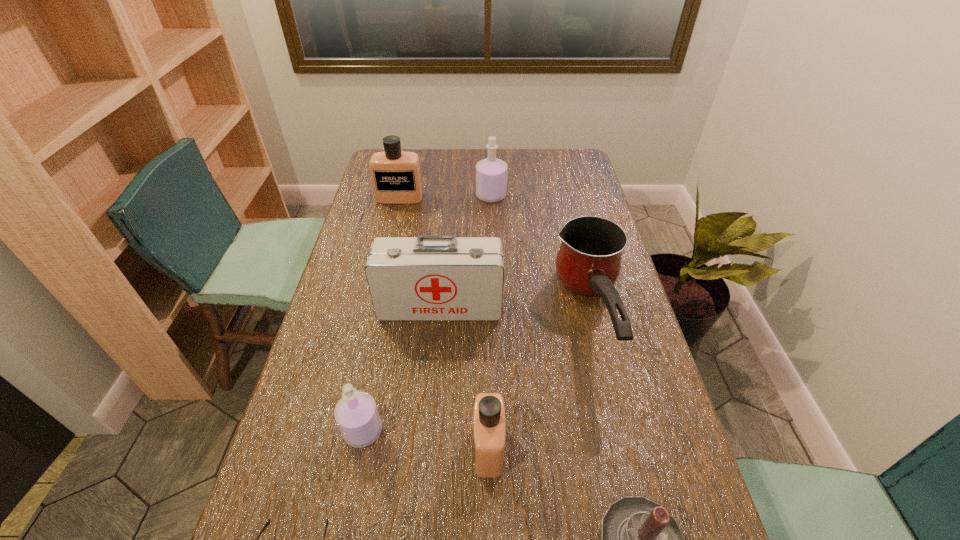
This screenshot has width=960, height=540. I want to click on the farther purple perfume, so click(491, 173).

Find the location of a particular element. The height and width of the screenshot is (540, 960). the bigger purple perfume is located at coordinates (491, 173).

Find the location of a particular element. the left beige perfume is located at coordinates (396, 176).

This screenshot has height=540, width=960. What are the coordinates of `the bigger beige perfume` in the screenshot? It's located at (396, 176).

Find the location of a particular element. red first-aid kit is located at coordinates (427, 278).

I want to click on saucepan, so click(x=588, y=262).

This screenshot has width=960, height=540. What are the coordinates of `the left purple perfume` in the screenshot? It's located at (356, 414).

The image size is (960, 540). Identify the location of the smaller purple perfume. (356, 414).

The image size is (960, 540). I want to click on the right beige perfume, so click(489, 427).

Find the location of a particular element. Image resolution: width=960 pixels, height=540 pixels. the smaller beige perfume is located at coordinates (489, 427).